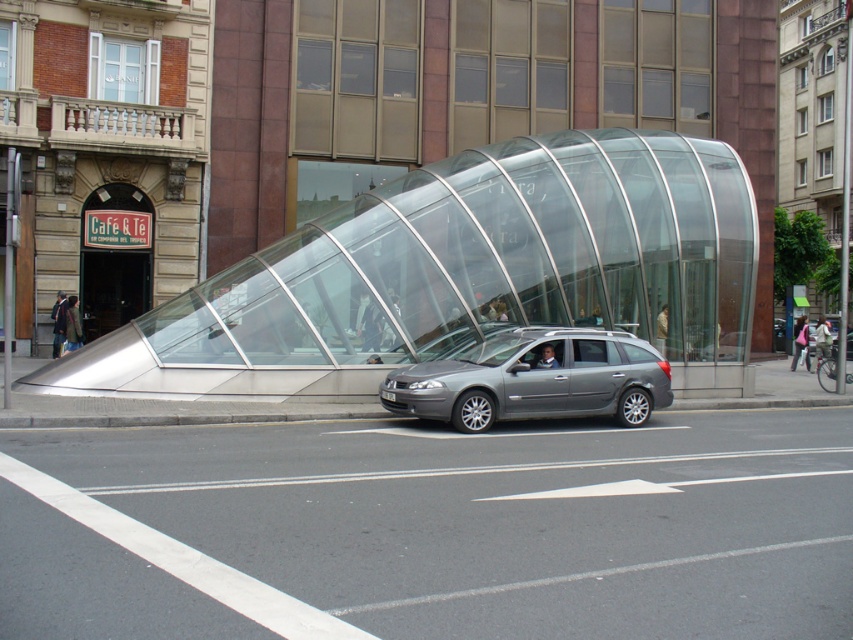
You are a delivery person who needs to park your truck, which is 2 meters tall, in the parking lot behind the building. The parking lot has a height restriction sign that says vehicles taller than 1.8 meters are not allowed. You see the silver metallic car at center and the metallic gray station wagon at center in the parking lot. Which vehicle is more likely to violate the height restriction?

The metallic gray station wagon at center is more likely to violate the height restriction because the silver metallic car at center is not as tall as it, and the height limit is 1.8 meters.

You are a delivery driver with a 2.5 meter wide truck. You need to park between the silver metallic car at center and the metallic gray station wagon at center. Is there enough space for your truck to fit between them?

The distance between the silver metallic car at center and the metallic gray station wagon at center is 3.05 meters. Since your truck is 2.5 meters wide, there is sufficient space to park between them as 3.05 meters is greater than 2.5 meters.

You are a pedestrian trying to cross the street and see the silver metallic car at center and the metallic gray station wagon at center. Which vehicle is closer to you?

The silver metallic car at center is closer to you because it is in front of the metallic gray station wagon at center.